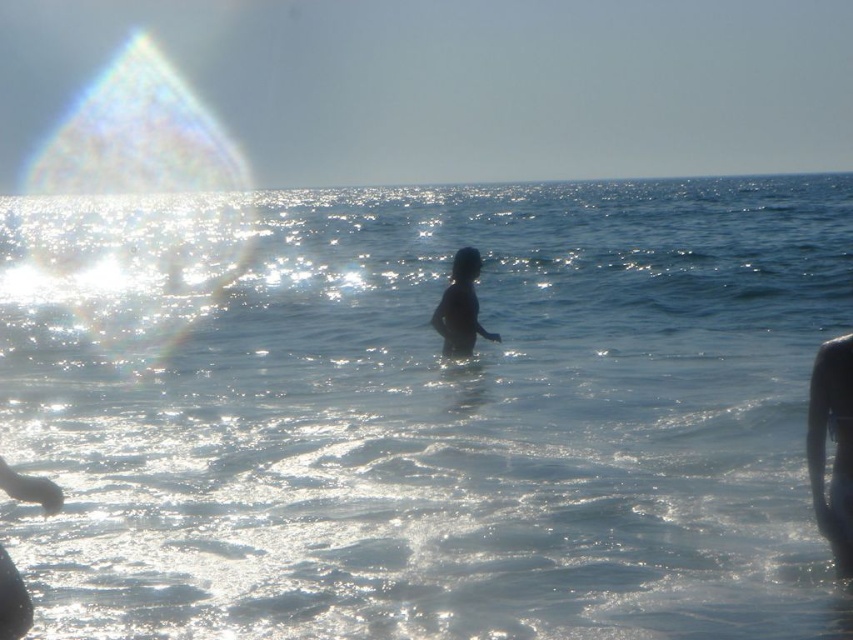
You are standing at point (459,298) and want to walk to the beach shore. If you walk straight ahead, will you first encounter point (581,284) or reach the shore first?

Since point (581,284) is behind point (459,298), walking straight ahead from point (459,298) would first reach the shore before encountering point (581,284).